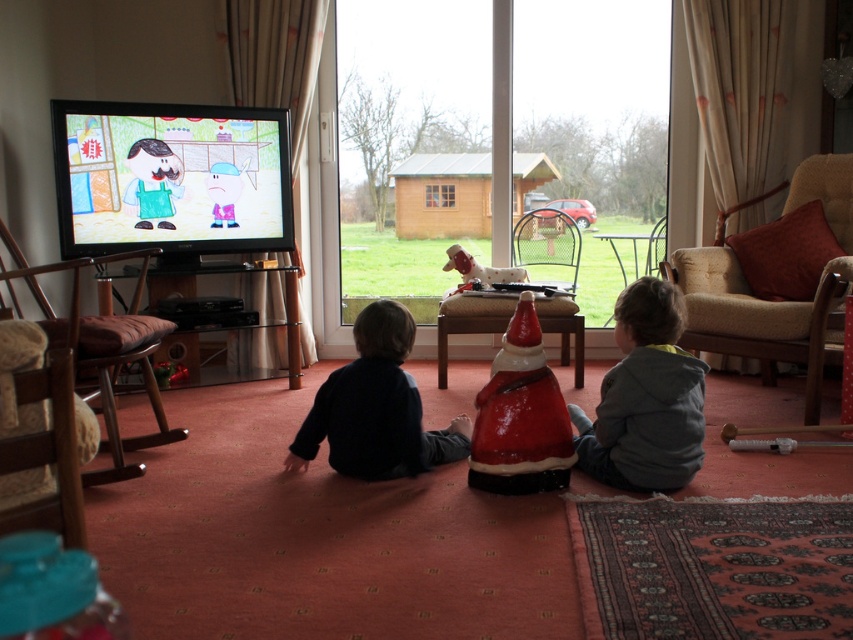
Question: Which point is farther to the camera?

Choices:
 (A) gray fleece jacket at lower right
 (B) dark blue sweater at center

Answer: (B)

Question: Is gray fleece jacket at lower right thinner than dark blue sweater at center?

Choices:
 (A) yes
 (B) no

Answer: (A)

Question: Is gray fleece jacket at lower right further to the viewer compared to dark blue sweater at center?

Choices:
 (A) yes
 (B) no

Answer: (B)

Question: Is gray fleece jacket at lower right to the right of dark blue sweater at center from the viewer's perspective?

Choices:
 (A) yes
 (B) no

Answer: (A)

Question: Among these objects, which one is farthest from the camera?

Choices:
 (A) dark blue sweater at center
 (B) gray fleece jacket at lower right

Answer: (A)